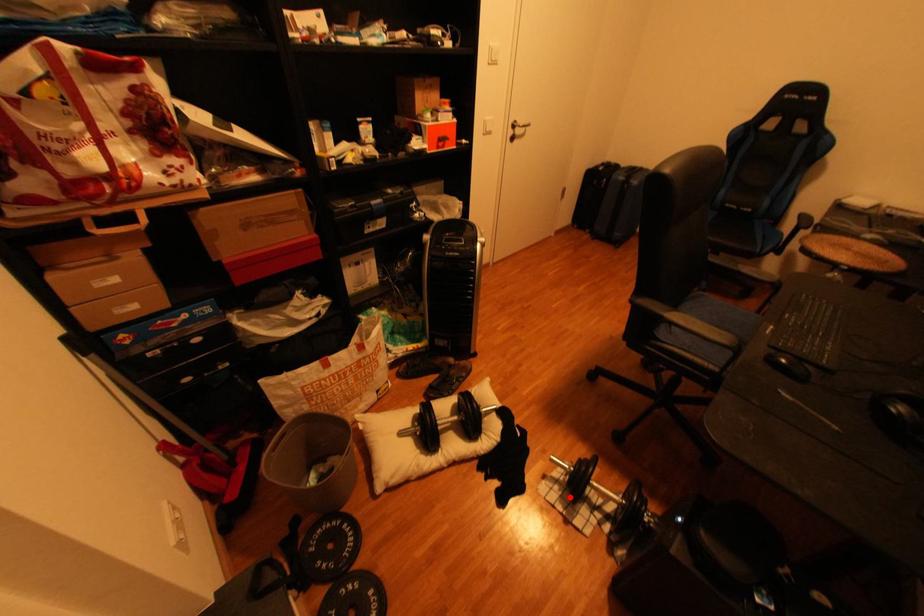
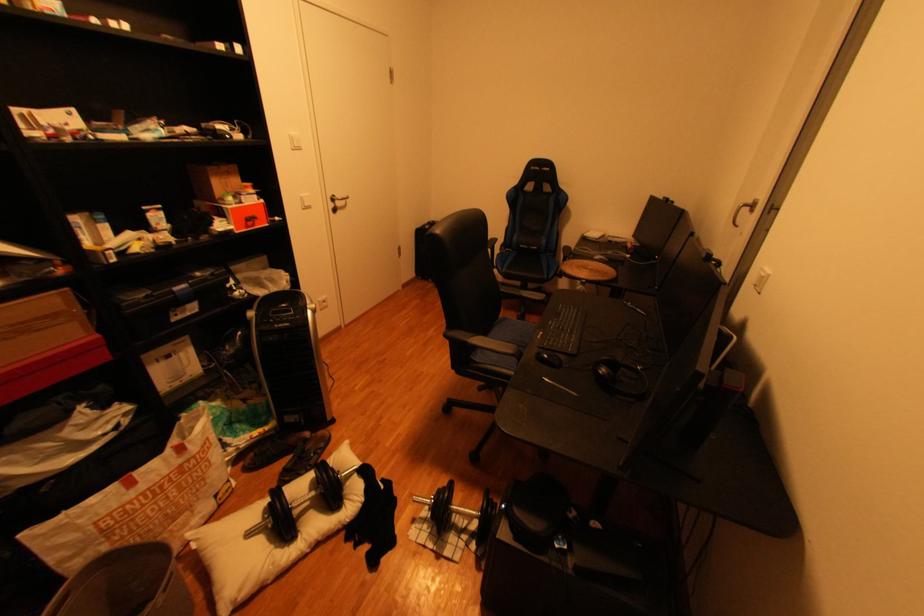
Question: I am providing you with two images of the same scene from different viewpoints. In image1, a red point is highlighted. Considering the same 3D point in image2, which of the following is correct?

Choices:
 (A) It is closer
 (B) It is farther

Answer: (B)